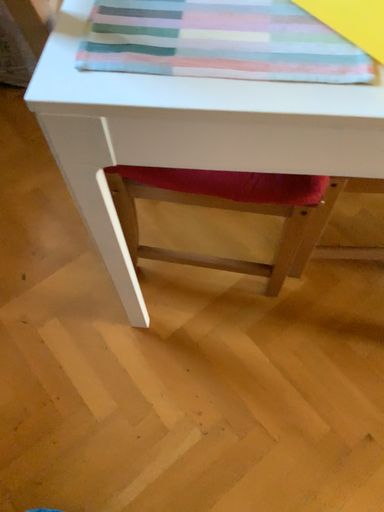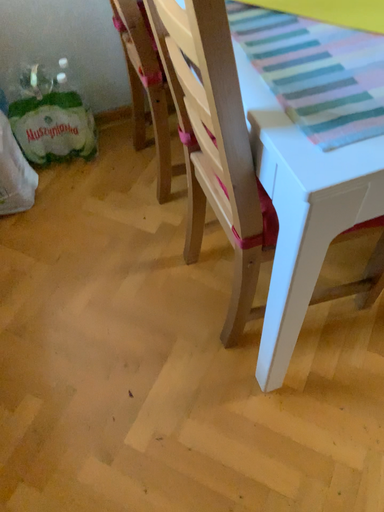
Question: How did the camera likely rotate when shooting the video?

Choices:
 (A) rotated left
 (B) rotated right

Answer: (B)